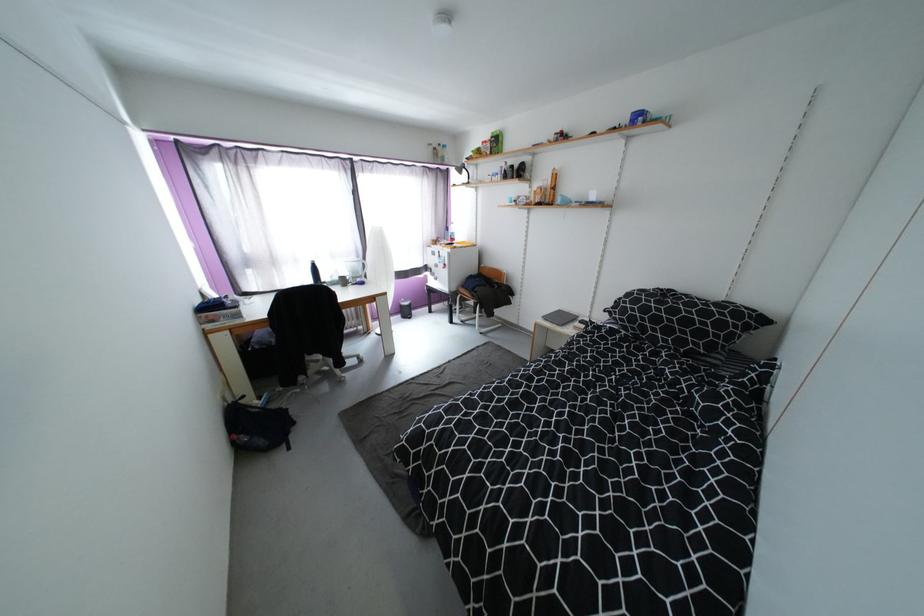
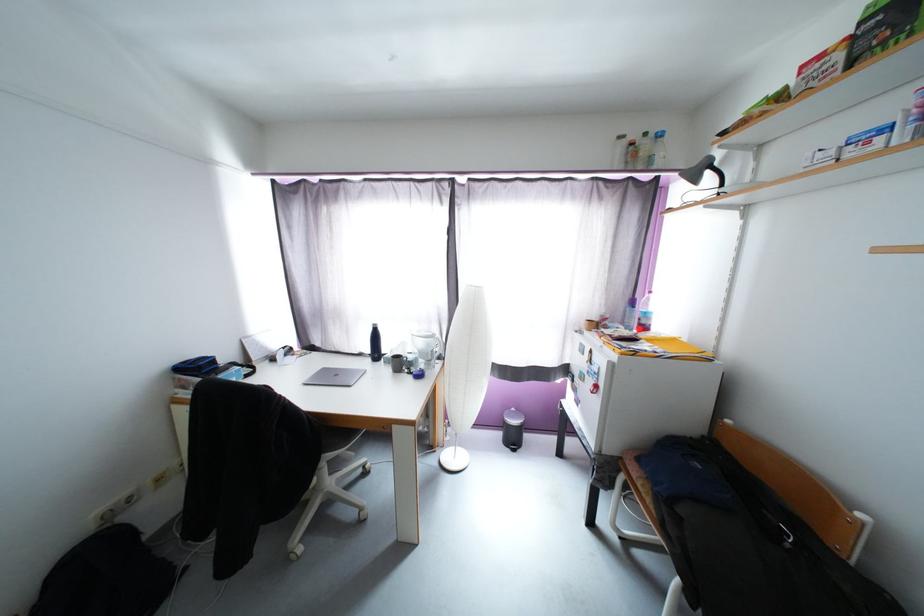
Locate, in the second image, the point that corresponds to pixel 363 359 in the first image.

(367, 511)